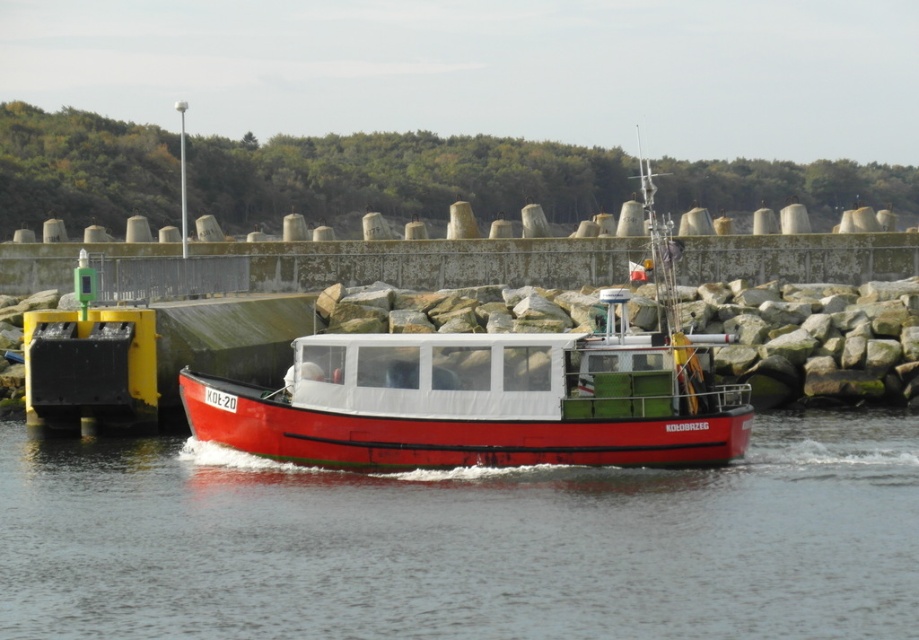
Is smooth water at boat right wider than matte red boat at center?

Yes.

Is smooth water at boat right smaller than matte red boat at center?

Correct, smooth water at boat right occupies less space than matte red boat at center.

Identify the location of smooth water at boat right. (464, 541).